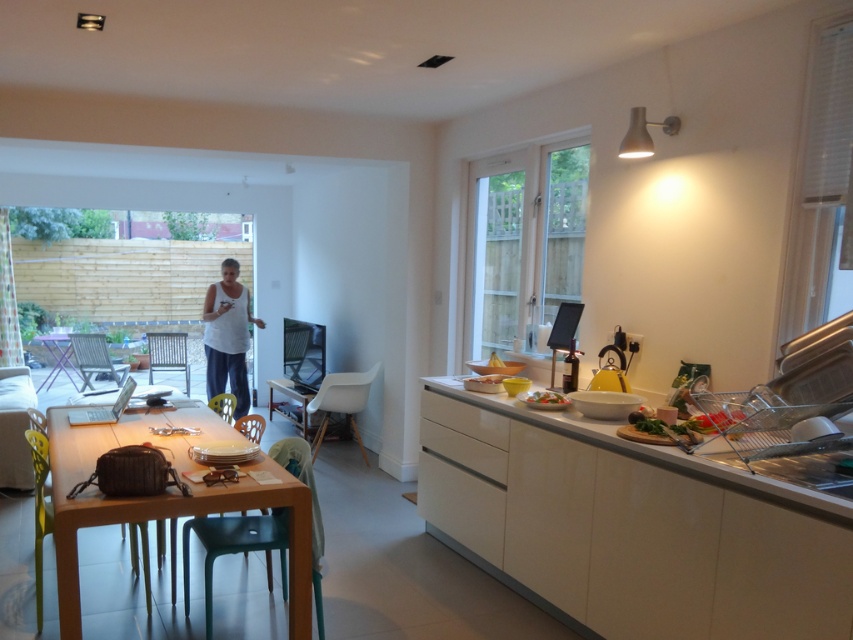
You are organizing the dining area and need to place a new centerpiece on the table. Considering the current arrangement, where relative to the white cotton shirt at center should the wooden table at center be placed?

The wooden table at center should be placed to the right side of the white cotton shirt at center, as it is already positioned there according to the description.

You are standing in the kitchen and see the white cotton shirt at center and the matte white plate at center. If you want to reach both items, which one will require you to walk further?

The white cotton shirt at center is 3.67 meters away from the matte white plate at center. Therefore, whichever item you choose to reach first, you will have to walk the distance between them. However, if you are starting from the same point, both items are at the same central position, so the distance to each depends on your starting location. The description only provides the distance between the two items, not their relation to your position.

You are organizing the dining table and need to decide where to place the white cotton shirt at center and the matte white plate at center. Since both items are at the center, which one should you move to make space for the other?

The white cotton shirt at center is larger in size than the matte white plate at center, so you should move the white cotton shirt at center to make space for the matte white plate at center.